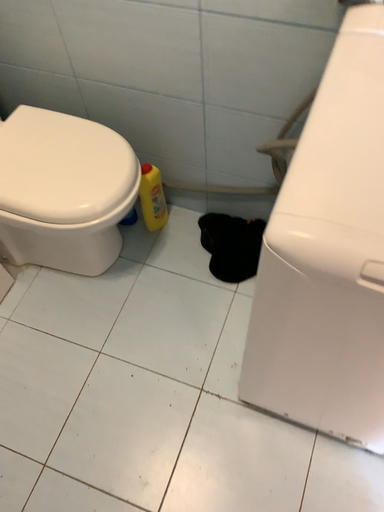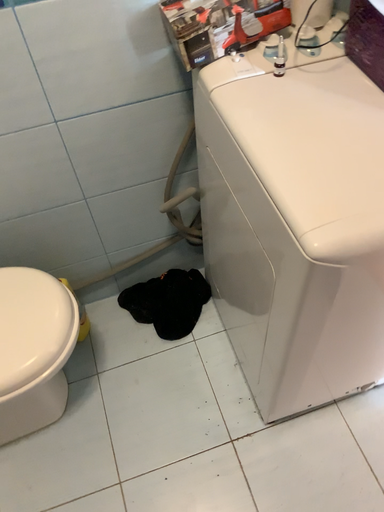
Question: How did the camera likely rotate when shooting the video?

Choices:
 (A) rotated right
 (B) rotated left

Answer: (A)